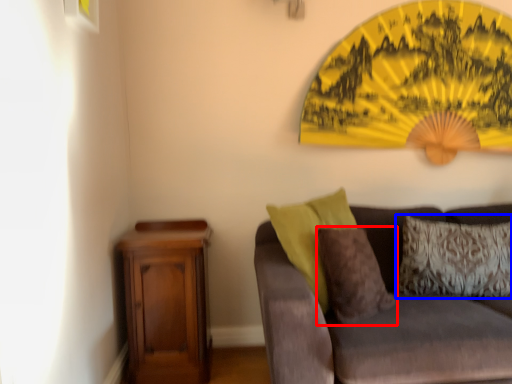
Question: Which object is further to the camera taking this photo, pillow (highlighted by a red box) or pillow (highlighted by a blue box)?

Choices:
 (A) pillow
 (B) pillow

Answer: (B)